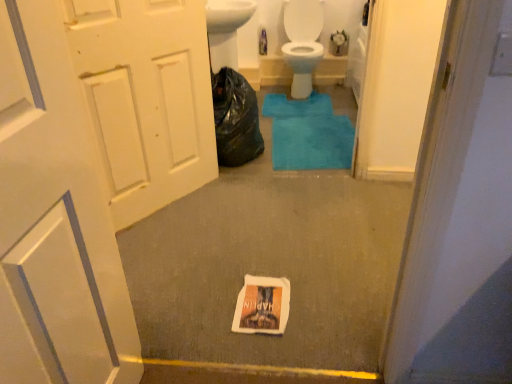
Locate an element on the screen. This screenshot has width=512, height=384. vacant space underneath white matte door at left, the first door from the back (from a real-world perspective) is located at coordinates (163, 203).